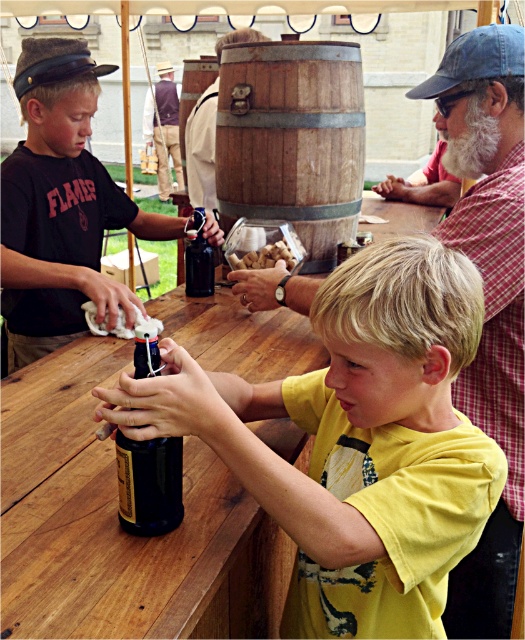
You are organizing a photo shoot and need to ensure that the checkered shirt at upper right and the dark blue glass bottle at center are both visible in the frame. Given their sizes, which object might require more space in the composition to avoid being cropped?

The checkered shirt at upper right is bigger than the dark blue glass bottle at center, so it would require more space in the composition to avoid being cropped.

You are a visitor at this historical event and want to place a small note on the wooden barrel at center so that it can be seen from afar. Considering the dark blue glass bottle at center is also nearby, which object would be better to place the note on for visibility?

The wooden barrel at center is much taller than the dark blue glass bottle at center, so placing the note on the wooden barrel at center would make it more visible from a distance.

You are standing at the entrance of the tent and want to place two markers at the locations of point (98, 538) and point (284, 291). Which point should you place first if you want to mark the closer one to the viewer first?

Point (98, 538) is closer to the viewer than point (284, 291), so you should place the marker at point (98, 538) first.